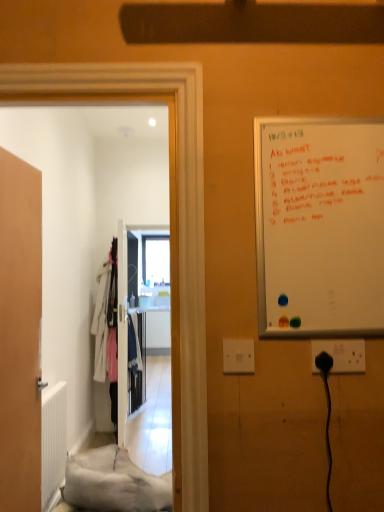
At what (x,y) coordinates should I click in order to perform the action: click on white carpet at lower left. Please return your answer as a coordinate pair (x, y). Looking at the image, I should click on (113, 483).

At what (x,y) coordinates should I click in order to perform the action: click on white matte radiator at lower left. Please return your answer as a coordinate pair (x, y). Looking at the image, I should click on (53, 443).

Identify the location of black plastic socket at lower right, the second electric outlet from the left. This screenshot has height=512, width=384. (341, 354).

In order to face whiteboard at right, should I rotate leftwards or rightwards?

Rotate right and turn 17.044 degrees.

Locate an element on the screen. The width and height of the screenshot is (384, 512). metallic silver clothes at center is located at coordinates (138, 369).

Locate an element on the screen. white carpet at lower left is located at coordinates (113, 483).

Is wooden door at left at the left side of white plastic electric outlet at center, the 2th electric outlet positioned from the right?

Yes.

Is wooden door at left taller than white plastic electric outlet at center, which is counted as the first electric outlet, starting from the left?

Indeed, wooden door at left has a greater height compared to white plastic electric outlet at center, which is counted as the first electric outlet, starting from the left.

Is wooden door at left bigger or smaller than white plastic electric outlet at center, which is counted as the first electric outlet, starting from the left?

Considering their sizes, wooden door at left takes up more space than white plastic electric outlet at center, which is counted as the first electric outlet, starting from the left.

Does point (17, 247) come farther from viewer compared to point (137, 476)?

No.

In terms of height, does wooden door at left look taller or shorter compared to white carpet at lower left?

In the image, wooden door at left appears to be taller than white carpet at lower left.

Is wooden door at left not close to white carpet at lower left?

No, wooden door at left is in close proximity to white carpet at lower left.

From the image's perspective, is wooden door at left positioned above or below white carpet at lower left?

From the image's perspective, wooden door at left appears above white carpet at lower left.

Does black plastic socket at lower right, the second electric outlet from the left, have a lesser width compared to white carpet at lower left?

Yes.

Looking at this image, which is behind, black plastic socket at lower right, the 1th electric outlet positioned from the right, or white carpet at lower left?

white carpet at lower left.

From a real-world perspective, which is physically below, black plastic socket at lower right, the second electric outlet from the left, or white carpet at lower left?

white carpet at lower left, from a real-world perspective.

Which is in front, point (352, 360) or point (150, 484)?

The point (352, 360) is closer to the camera.

Considering the points (11, 315) and (349, 362), which point is in front, point (11, 315) or point (349, 362)?

The point (349, 362) is more forward.

Which object is thinner, wooden door at left or black plastic socket at lower right, the second electric outlet from the left?

black plastic socket at lower right, the second electric outlet from the left, is thinner.

What's the angular difference between wooden door at left and black plastic socket at lower right, the second electric outlet from the left,'s facing directions?

The angular difference between wooden door at left and black plastic socket at lower right, the second electric outlet from the left, is 84 degrees.

Between wooden door at left and black plastic socket at lower right, the second electric outlet from the left, which one has less height?

black plastic socket at lower right, the second electric outlet from the left.

Is whiteboard at right facing towards white plastic electric outlet at center, the 2th electric outlet positioned from the right?

No, whiteboard at right is not facing towards white plastic electric outlet at center, the 2th electric outlet positioned from the right.

Can you confirm if whiteboard at right is taller than white plastic electric outlet at center, which is counted as the first electric outlet, starting from the left?

Indeed, whiteboard at right has a greater height compared to white plastic electric outlet at center, which is counted as the first electric outlet, starting from the left.

Is whiteboard at right in contact with white plastic electric outlet at center, the 2th electric outlet positioned from the right?

There is a gap between whiteboard at right and white plastic electric outlet at center, the 2th electric outlet positioned from the right.

Considering their positions, is whiteboard at right located in front of or behind white plastic electric outlet at center, which is counted as the first electric outlet, starting from the left?

Visually, whiteboard at right is located behind white plastic electric outlet at center, which is counted as the first electric outlet, starting from the left.

Would you say white matte radiator at lower left is inside or outside whiteboard at right?

white matte radiator at lower left lies outside whiteboard at right.

Based on the photo, what's the angular difference between white matte radiator at lower left and whiteboard at right's facing directions?

The angle between the facing direction of white matte radiator at lower left and the facing direction of whiteboard at right is 94.4 degrees.

Could you tell me if white matte radiator at lower left is facing whiteboard at right?

No, white matte radiator at lower left is not facing towards whiteboard at right.

Who is taller, white matte radiator at lower left or whiteboard at right?

white matte radiator at lower left is taller.

From the picture: Is metallic silver clothes at center located outside whiteboard at right?

Yes, metallic silver clothes at center is outside of whiteboard at right.

Who is shorter, metallic silver clothes at center or whiteboard at right?

whiteboard at right is shorter.

Considering the relative sizes of metallic silver clothes at center and whiteboard at right in the image provided, is metallic silver clothes at center thinner than whiteboard at right?

No, metallic silver clothes at center is not thinner than whiteboard at right.

Which is in front, metallic silver clothes at center or whiteboard at right?

whiteboard at right.

Where is `door below the white plastic electric outlet at center, the 2th electric outlet positioned from the right (from the image's perspective)`? This screenshot has height=512, width=384. door below the white plastic electric outlet at center, the 2th electric outlet positioned from the right (from the image's perspective) is located at coordinates (20, 334).

In order to click on door above the white carpet at lower left (from the image's perspective) in this screenshot , I will do `click(20, 334)`.

From the image, which object appears to be nearer to white plastic electric outlet at center, the 2th electric outlet positioned from the right, white carpet at lower left or metallic silver clothes at center?

white carpet at lower left is closer to white plastic electric outlet at center, the 2th electric outlet positioned from the right.

Based on their spatial positions, is black plastic socket at lower right, the 1th electric outlet positioned from the right, or white matte radiator at lower left closer to wooden door at left?

white matte radiator at lower left is closer to wooden door at left.

Estimate the real-world distances between objects in this image. Which object is closer to white plastic electric outlet at center, which is counted as the first electric outlet, starting from the left, white matte radiator at lower left or white carpet at lower left?

The object closer to white plastic electric outlet at center, which is counted as the first electric outlet, starting from the left, is white carpet at lower left.

From the image, which object appears to be farther from black plastic socket at lower right, the second electric outlet from the left, white plastic electric outlet at center, which is counted as the first electric outlet, starting from the left, or whiteboard at right?

Among the two, whiteboard at right is located further to black plastic socket at lower right, the second electric outlet from the left.

In the scene shown: Looking at the image, which one is located further to whiteboard at right, white matte radiator at lower left or metallic silver clothes at center?

metallic silver clothes at center is further to whiteboard at right.

Looking at this image, estimate the real-world distances between objects in this image. Which object is closer to metallic silver clothes at center, white plastic electric outlet at center, the 2th electric outlet positioned from the right, or black plastic socket at lower right, the 1th electric outlet positioned from the right?

white plastic electric outlet at center, the 2th electric outlet positioned from the right, is positioned closer to the anchor metallic silver clothes at center.

Based on their spatial positions, is whiteboard at right or white matte radiator at lower left closer to metallic silver clothes at center?

The object closer to metallic silver clothes at center is white matte radiator at lower left.

Considering their positions, is whiteboard at right positioned closer to wooden door at left than white carpet at lower left?

white carpet at lower left is closer to wooden door at left.

Image resolution: width=384 pixels, height=512 pixels. Identify the location of electric outlet located between white plastic electric outlet at center, the 2th electric outlet positioned from the right, and metallic silver clothes at center in the depth direction. 341,354.

Where is `whiteboard positioned between white plastic electric outlet at center, which is counted as the first electric outlet, starting from the left, and white matte radiator at lower left from near to far`? The height and width of the screenshot is (512, 384). whiteboard positioned between white plastic electric outlet at center, which is counted as the first electric outlet, starting from the left, and white matte radiator at lower left from near to far is located at coordinates (319, 227).

You are a GUI agent. You are given a task and a screenshot of the screen. Output one action in this format:
    pyautogui.click(x=<x>, y=<y>)
    Task: Click on the radiator between white plastic electric outlet at center, the 2th electric outlet positioned from the right, and metallic silver clothes at center, along the z-axis
    
    Given the screenshot: What is the action you would take?
    pyautogui.click(x=53, y=443)

Identify the location of radiator between whiteboard at right and white carpet at lower left vertically. The width and height of the screenshot is (384, 512). (53, 443).